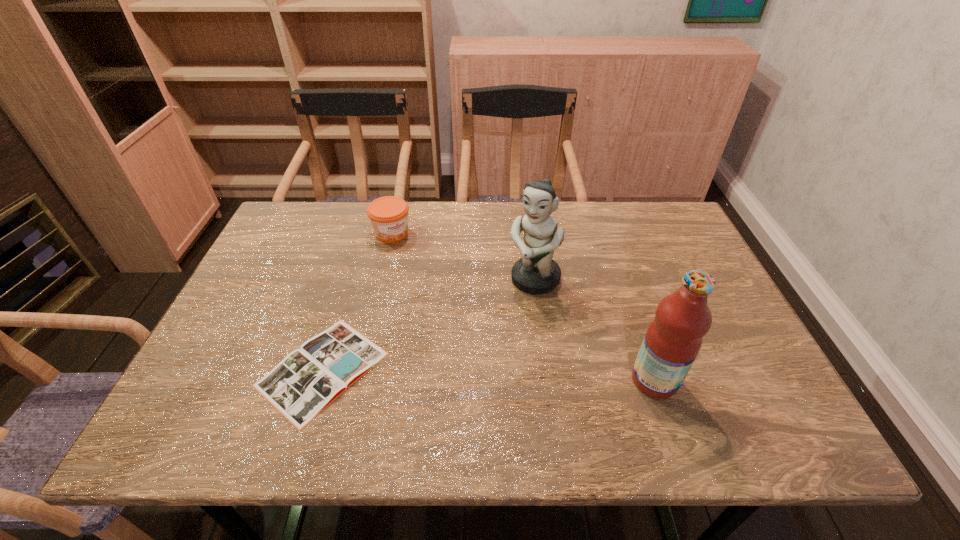
Where is `vacant space that satisfies the following two spatial constraints: 1. on the front side of the fruit juice; 2. on the front label of the third tallest object`? This screenshot has width=960, height=540. vacant space that satisfies the following two spatial constraints: 1. on the front side of the fruit juice; 2. on the front label of the third tallest object is located at coordinates (357, 380).